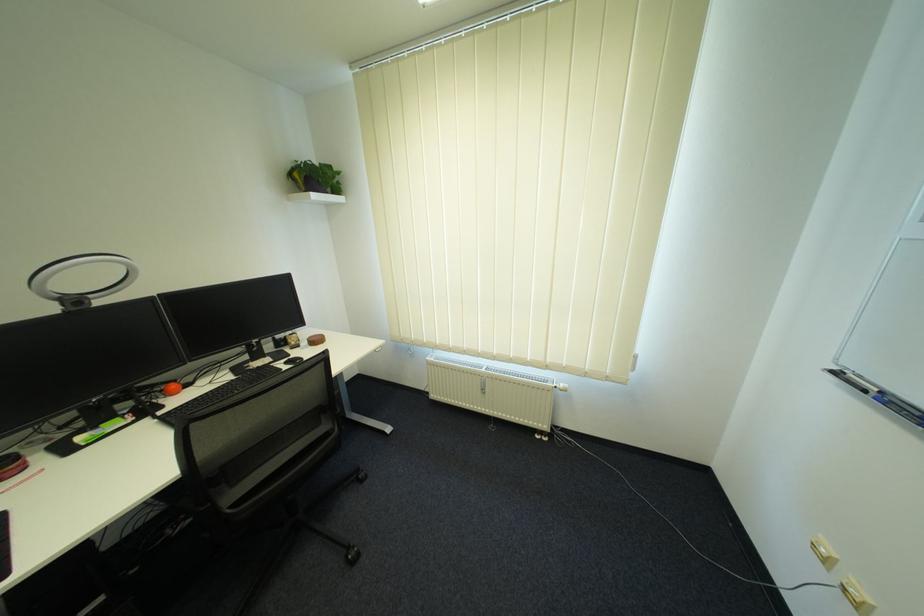
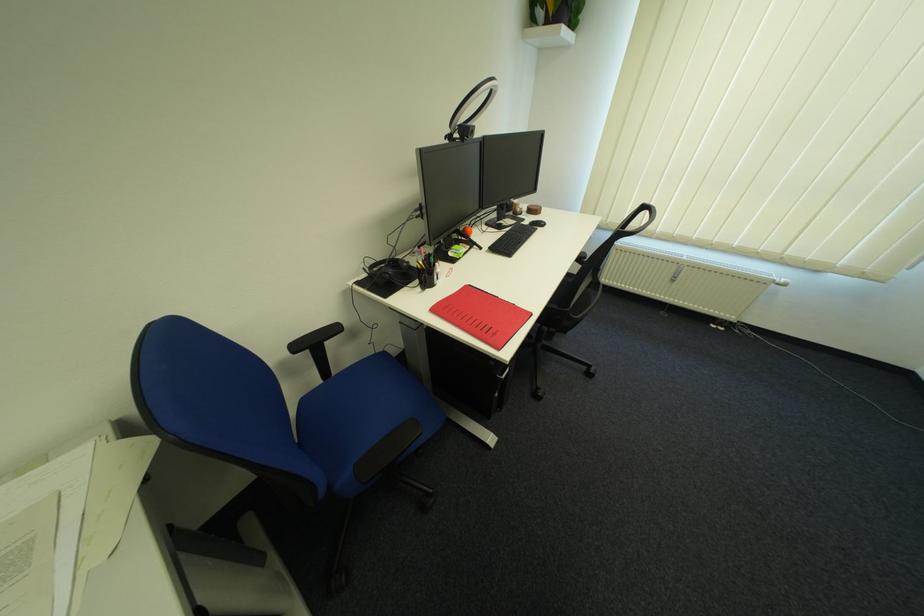
Find the pixel in the second image that matches pixel 298 357 in the first image.

(532, 221)